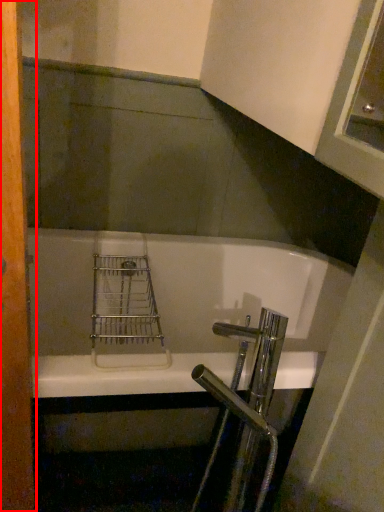
Question: Considering the relative positions of screen door (annotated by the red box) and bathtub in the image provided, where is screen door (annotated by the red box) located with respect to the staircase?

Choices:
 (A) right
 (B) left

Answer: (B)